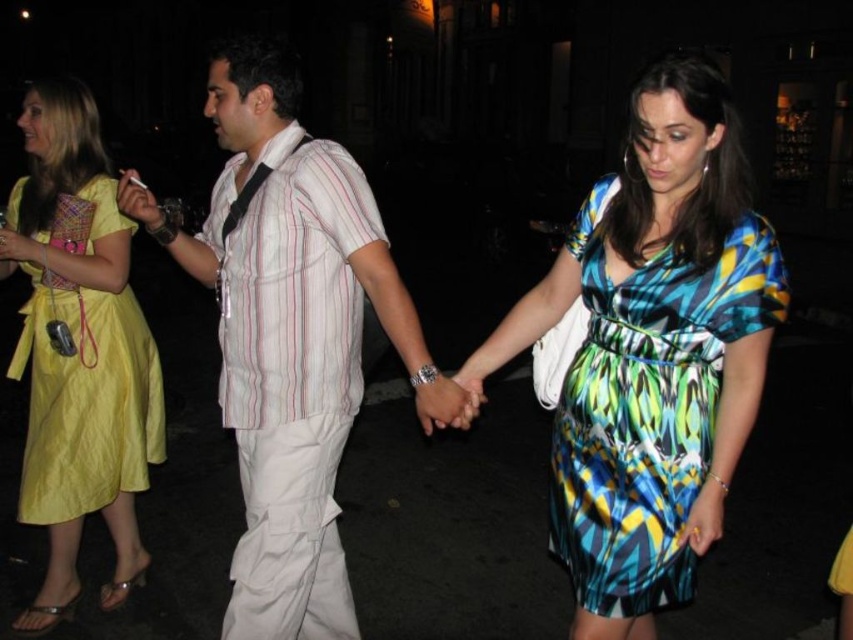
What is the position of the point with coordinates (647,406) in relation to the printed silk dress at center?

The point with coordinates (647,406) is located on the printed silk dress at center.